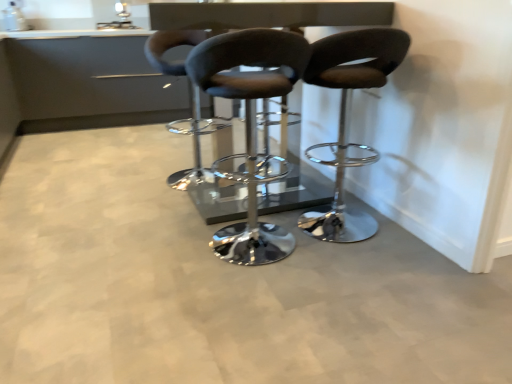
Locate an element on the screen. matte black stool at center, the second chair viewed from the right is located at coordinates (251, 128).

Measure the distance between point (168, 17) and camera.

A distance of 1.80 meters exists between point (168, 17) and camera.

Identify the location of matte black stool at center, which is counted as the second chair, starting from the left. (251, 128).

In the scene shown: Between matte black stool at center, placed as the 1th chair when sorted from right to left, and glossy black table at center, which one has larger size?

Bigger between the two is glossy black table at center.

Is matte black stool at center, placed as the 1th chair when sorted from right to left, inside or outside of glossy black table at center?

matte black stool at center, placed as the 1th chair when sorted from right to left, cannot be found inside glossy black table at center.

From a real-world perspective, which is physically below, matte black stool at center, placed as the 1th chair when sorted from right to left, or glossy black table at center?

matte black stool at center, placed as the 1th chair when sorted from right to left, is physically lower.

Is matte black stool at center, placed as the 1th chair when sorted from right to left, oriented towards glossy black table at center?

Yes, matte black stool at center, placed as the 1th chair when sorted from right to left, is oriented towards glossy black table at center.

From the image's perspective, is matte black stool at center, placed as the 1th chair when sorted from right to left, over matte black stool at center, the 3th chair in the right-to-left sequence?

No, from the image's perspective, matte black stool at center, placed as the 1th chair when sorted from right to left, is not over matte black stool at center, the 3th chair in the right-to-left sequence.

Is matte black stool at center, the 1th chair when ordered from left to right, a part of matte black stool at center, the 3th chair from the left?

No, matte black stool at center, the 1th chair when ordered from left to right, is located outside of matte black stool at center, the 3th chair from the left.

From a real-world perspective, between matte black stool at center, placed as the 1th chair when sorted from right to left, and matte black stool at center, the 1th chair when ordered from left to right, who is vertically lower?

matte black stool at center, the 1th chair when ordered from left to right, is physically lower.

Based on the photo, considering the relative positions of matte black stool at center, placed as the 1th chair when sorted from right to left, and matte black stool at center, the 3th chair in the right-to-left sequence, in the image provided, is matte black stool at center, placed as the 1th chair when sorted from right to left, to the right of matte black stool at center, the 3th chair in the right-to-left sequence, from the viewer's perspective?

Yes.

From a real-world perspective, is matte black stool at center, the 3th chair from the left, on top of matte black stool at center, which is counted as the second chair, starting from the left?

Yes, from a real-world perspective, matte black stool at center, the 3th chair from the left, is on top of matte black stool at center, which is counted as the second chair, starting from the left.

Which object is thinner, matte black stool at center, placed as the 1th chair when sorted from right to left, or matte black stool at center, the second chair viewed from the right?

matte black stool at center, the second chair viewed from the right, is thinner.

From the picture: Could you tell me if matte black stool at center, placed as the 1th chair when sorted from right to left, is turned towards matte black stool at center, which is counted as the second chair, starting from the left?

No, matte black stool at center, placed as the 1th chair when sorted from right to left, is not oriented towards matte black stool at center, which is counted as the second chair, starting from the left.

Is matte black stool at center, which is counted as the second chair, starting from the left, surrounded by matte black stool at center, the 3th chair from the left?

No, matte black stool at center, which is counted as the second chair, starting from the left, is not a part of matte black stool at center, the 3th chair from the left.

Is matte black stool at center, the 3th chair in the right-to-left sequence, turned away from matte black stool at center, the second chair viewed from the right?

No, matte black stool at center, the second chair viewed from the right, is not at the back of matte black stool at center, the 3th chair in the right-to-left sequence.

From the image's perspective, which object appears higher, matte black stool at center, the 1th chair when ordered from left to right, or matte black stool at center, which is counted as the second chair, starting from the left?

matte black stool at center, the 1th chair when ordered from left to right, is shown above in the image.

From the picture: How many degrees apart are the facing directions of matte black stool at center, the 3th chair in the right-to-left sequence, and matte black stool at center, the second chair viewed from the right?

matte black stool at center, the 3th chair in the right-to-left sequence, and matte black stool at center, the second chair viewed from the right, are facing 180 degrees away from each other.

From a real-world perspective, is matte black stool at center, the 1th chair when ordered from left to right, positioned above or below matte black stool at center, which is counted as the second chair, starting from the left?

Clearly, from a real-world perspective, matte black stool at center, the 1th chair when ordered from left to right, is below matte black stool at center, which is counted as the second chair, starting from the left.

What's the angular difference between matte black stool at center, the second chair viewed from the right, and matte silver sink at upper center's facing directions?

The facing directions of matte black stool at center, the second chair viewed from the right, and matte silver sink at upper center are 178 degrees apart.

How much distance is there between matte black stool at center, which is counted as the second chair, starting from the left, and matte silver sink at upper center?

The distance of matte black stool at center, which is counted as the second chair, starting from the left, from matte silver sink at upper center is 1.72 meters.

From a real-world perspective, is matte black stool at center, the second chair viewed from the right, physically located above or below matte silver sink at upper center?

matte black stool at center, the second chair viewed from the right, is situated lower than matte silver sink at upper center in the real world.

Which object is positioned more to the left, matte black stool at center, the second chair viewed from the right, or matte silver sink at upper center?

matte silver sink at upper center is more to the left.

Is matte silver sink at upper center in front of or behind matte black stool at center, placed as the 1th chair when sorted from right to left, in the image?

Clearly, matte silver sink at upper center is behind matte black stool at center, placed as the 1th chair when sorted from right to left.

Is matte silver sink at upper center in contact with matte black stool at center, the 3th chair from the left?

No, matte silver sink at upper center is not with matte black stool at center, the 3th chair from the left.

Visually, is matte silver sink at upper center positioned to the left or to the right of matte black stool at center, the 3th chair from the left?

From the image, it's evident that matte silver sink at upper center is to the left of matte black stool at center, the 3th chair from the left.

What's the angular difference between matte silver sink at upper center and matte black stool at center, placed as the 1th chair when sorted from right to left,'s facing directions?

178 degrees separate the facing orientations of matte silver sink at upper center and matte black stool at center, placed as the 1th chair when sorted from right to left.

Looking at this image, is glossy black table at center far from matte black stool at center, which is counted as the second chair, starting from the left?

That's right, there is a large distance between glossy black table at center and matte black stool at center, which is counted as the second chair, starting from the left.

Considering the sizes of objects glossy black table at center and matte black stool at center, the second chair viewed from the right, in the image provided, who is thinner, glossy black table at center or matte black stool at center, the second chair viewed from the right,?

matte black stool at center, the second chair viewed from the right, is thinner.

In the scene shown: From the image's perspective, is glossy black table at center over matte black stool at center, the second chair viewed from the right?

Yes, from the image's perspective, glossy black table at center is above matte black stool at center, the second chair viewed from the right.

Consider the image. How different are the orientations of glossy black table at center and matte black stool at center, which is counted as the second chair, starting from the left, in degrees?

They differ by 90 degrees in their facing directions.

You are a GUI agent. You are given a task and a screenshot of the screen. Output one action in this format:
    pyautogui.click(x=<x>, y=<y>)
    Task: Click on the 1st chair in front of the glossy black table at center
    This screenshot has height=384, width=512.
    Given the screenshot: What is the action you would take?
    345,120

You are a GUI agent. You are given a task and a screenshot of the screen. Output one action in this format:
    pyautogui.click(x=<x>, y=<y>)
    Task: Click on the chair above the matte black stool at center, placed as the 1th chair when sorted from right to left (from the image's perspective)
    
    Given the screenshot: What is the action you would take?
    pyautogui.click(x=194, y=143)

From the image, which object appears to be farther from matte black stool at center, the 3th chair from the left, matte black stool at center, the 1th chair when ordered from left to right, or glossy black table at center?

glossy black table at center is positioned further to the anchor matte black stool at center, the 3th chair from the left.

When comparing their distances from matte black stool at center, the 1th chair when ordered from left to right, does matte black stool at center, which is counted as the second chair, starting from the left, or matte silver sink at upper center seem further?

matte silver sink at upper center.

Looking at the image, which one is located closer to matte black stool at center, placed as the 1th chair when sorted from right to left, matte black stool at center, the 1th chair when ordered from left to right, or matte black stool at center, which is counted as the second chair, starting from the left?

matte black stool at center, which is counted as the second chair, starting from the left.

Looking at this image, based on their spatial positions, is matte silver sink at upper center or matte black stool at center, which is counted as the second chair, starting from the left, further from matte black stool at center, placed as the 1th chair when sorted from right to left?

The object further to matte black stool at center, placed as the 1th chair when sorted from right to left, is matte silver sink at upper center.

Estimate the real-world distances between objects in this image. Which object is closer to matte black stool at center, placed as the 1th chair when sorted from right to left, matte black stool at center, the second chair viewed from the right, or matte silver sink at upper center?

Among the two, matte black stool at center, the second chair viewed from the right, is located nearer to matte black stool at center, placed as the 1th chair when sorted from right to left.

Based on the photo, when comparing their distances from matte black stool at center, placed as the 1th chair when sorted from right to left, does glossy black table at center or matte black stool at center, the 3th chair in the right-to-left sequence, seem further?

glossy black table at center.

Based on their spatial positions, is matte silver sink at upper center or glossy black table at center closer to matte black stool at center, the 3th chair from the left?

glossy black table at center lies closer to matte black stool at center, the 3th chair from the left, than the other object.

When comparing their distances from glossy black table at center, does matte black stool at center, which is counted as the second chair, starting from the left, or matte black stool at center, the 3th chair in the right-to-left sequence, seem closer?

matte black stool at center, the 3th chair in the right-to-left sequence, lies closer to glossy black table at center than the other object.

Find the location of a particular element. The height and width of the screenshot is (384, 512). chair between glossy black table at center and matte silver sink at upper center from front to back is located at coordinates (194, 143).

At what (x,y) coordinates should I click in order to perform the action: click on table between matte black stool at center, the 3th chair in the right-to-left sequence, and matte black stool at center, the 3th chair from the left, from left to right. Please return your answer as a coordinate pair (x, y). Looking at the image, I should click on (249, 21).

The width and height of the screenshot is (512, 384). Find the location of `chair located between matte black stool at center, the 3th chair from the left, and matte silver sink at upper center in the depth direction`. chair located between matte black stool at center, the 3th chair from the left, and matte silver sink at upper center in the depth direction is located at coordinates (194, 143).

Where is `chair located between matte black stool at center, the second chair viewed from the right, and matte black stool at center, the 1th chair when ordered from left to right, in the depth direction`? chair located between matte black stool at center, the second chair viewed from the right, and matte black stool at center, the 1th chair when ordered from left to right, in the depth direction is located at coordinates (345, 120).